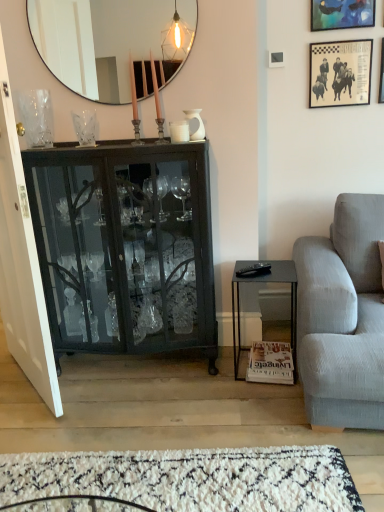
You are a GUI agent. You are given a task and a screenshot of the screen. Output one action in this format:
    pyautogui.click(x=<x>, y=<y>)
    Task: Click on the free space above white shag rug at lower center (from a real-world perspective)
    
    Given the screenshot: What is the action you would take?
    pyautogui.click(x=132, y=479)